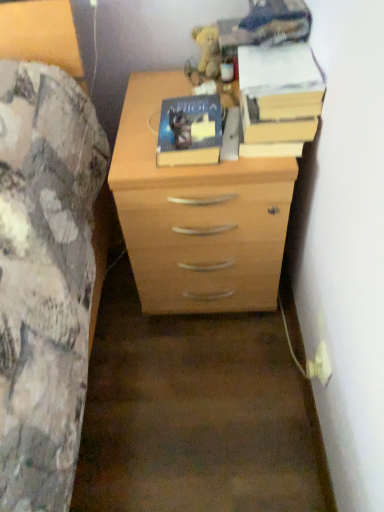
At what (x,y) coordinates should I click in order to perform the action: click on vacant space to the left of yellow paper at upper right, positioned as the 1th paperback book in right-to-left order. Please return your answer as a coordinate pair (x, y). Looking at the image, I should click on (160, 114).